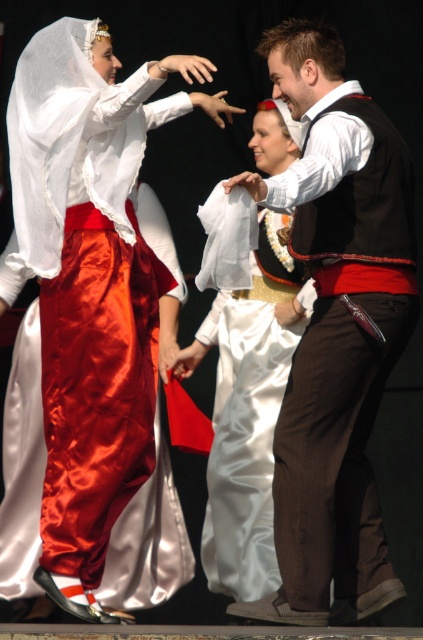
Between point (331, 84) and point (2, 266), which one is positioned in front?

Point (331, 84) is more forward.

The image size is (423, 640). I want to click on matte brown vest at center, so click(335, 330).

Who is more distant from viewer, (x=371, y=234) or (x=109, y=547)?

The point (x=109, y=547) is more distant.

Find the location of a particular element. The height and width of the screenshot is (640, 423). matte brown vest at center is located at coordinates (335, 330).

Is satin white dress at center shorter than satin/velvet dress at left?

In fact, satin white dress at center may be taller than satin/velvet dress at left.

Is satin white dress at center taller than satin/velvet dress at left?

Correct, satin white dress at center is much taller as satin/velvet dress at left.

Does point (211, 490) come farther from viewer compared to point (186, 564)?

No, (211, 490) is closer to viewer.

Find the location of a particular element. This screenshot has height=640, width=423. satin white dress at center is located at coordinates (247, 410).

Which is behind, point (338, 548) or point (208, 465)?

The point (208, 465) is behind.

Is point (354, 106) closer to viewer compared to point (274, 291)?

Yes, point (354, 106) is in front of point (274, 291).

In order to click on matte brown vest at center in this screenshot , I will do coord(335,330).